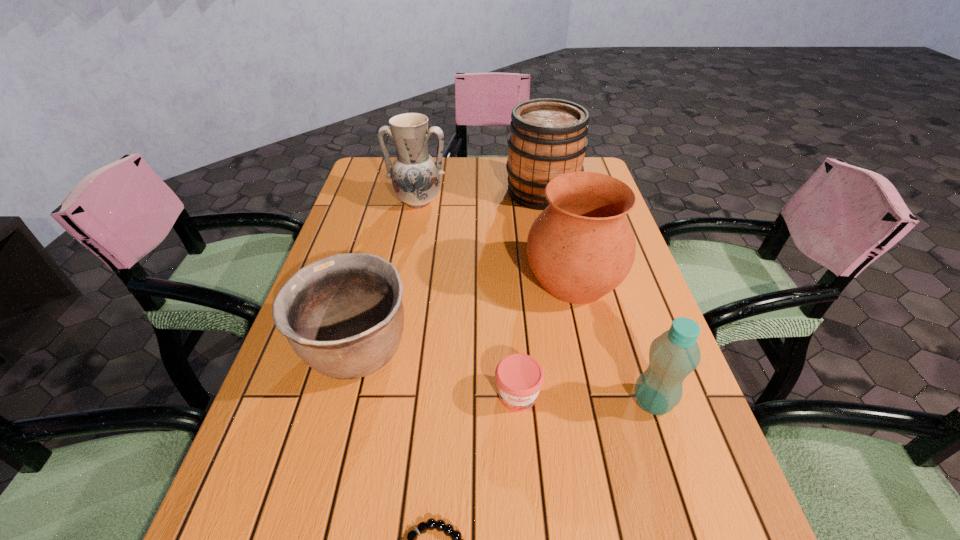
Image resolution: width=960 pixels, height=540 pixels. In order to click on vacant space located 0.260m at the front cap of the water bottle in this screenshot , I will do point(496,402).

You are a GUI agent. You are given a task and a screenshot of the screen. Output one action in this format:
    pyautogui.click(x=<x>, y=<y>)
    Task: Click on the vacant space situated at the front cap of the water bottle
    
    Given the screenshot: What is the action you would take?
    pyautogui.click(x=564, y=402)

At what (x,y) coordinates should I click in order to perform the action: click on vacant space situated 0.390m on the right of the fifth tallest object. Please return your answer as a coordinate pair (x, y). This screenshot has height=540, width=960. Looking at the image, I should click on (597, 353).

The height and width of the screenshot is (540, 960). I want to click on vacant region located 0.140m on the front label of the second shortest object, so click(x=525, y=494).

Where is `pottery present at the far edge`? pottery present at the far edge is located at coordinates (415, 175).

Where is `cider present at the far edge`? This screenshot has width=960, height=540. cider present at the far edge is located at coordinates (548, 138).

Image resolution: width=960 pixels, height=540 pixels. Find the location of `cider situated at the right edge`. cider situated at the right edge is located at coordinates (548, 138).

At what (x,y) coordinates should I click in order to perform the action: click on pottery at the right edge. Please return your answer as a coordinate pair (x, y). This screenshot has height=540, width=960. Looking at the image, I should click on (581, 247).

Identify the location of water bottle that is at the right edge. The width and height of the screenshot is (960, 540). (673, 355).

Find the location of `object that is at the far left corner`. object that is at the far left corner is located at coordinates (415, 175).